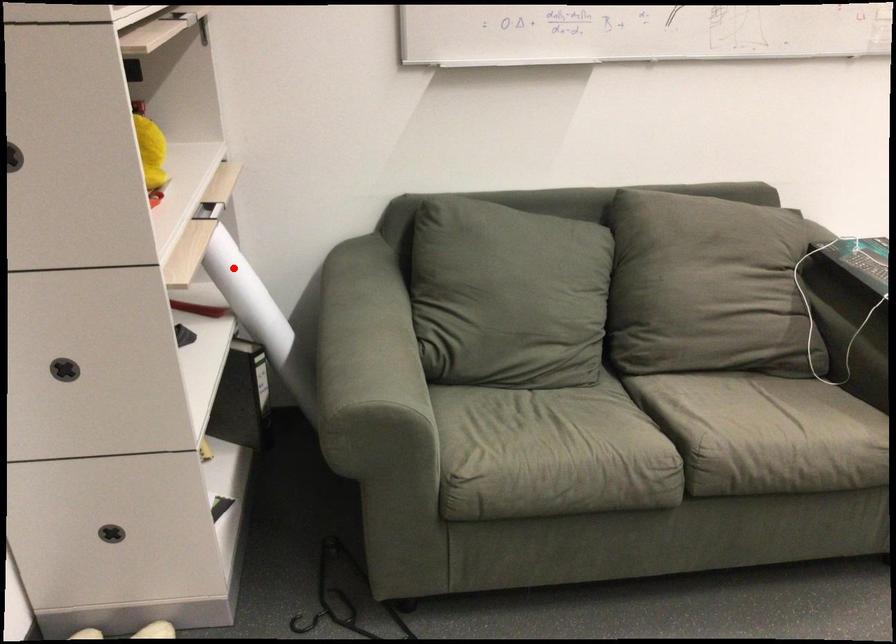
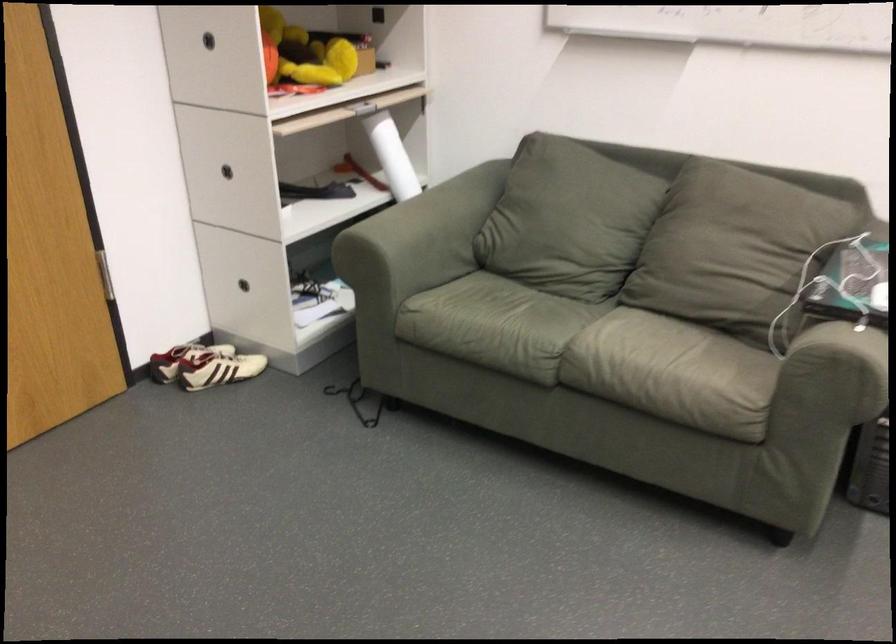
Locate, in the second image, the point that corresponds to the highlighted location in the first image.

(392, 156)